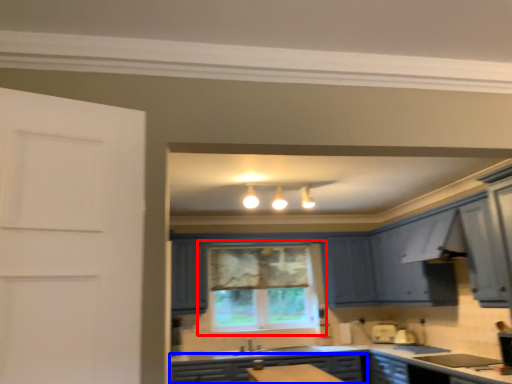
Question: Among these objects, which one is farthest to the camera, window (highlighted by a red box) or cabinetry (highlighted by a blue box)?

Choices:
 (A) window
 (B) cabinetry

Answer: (A)